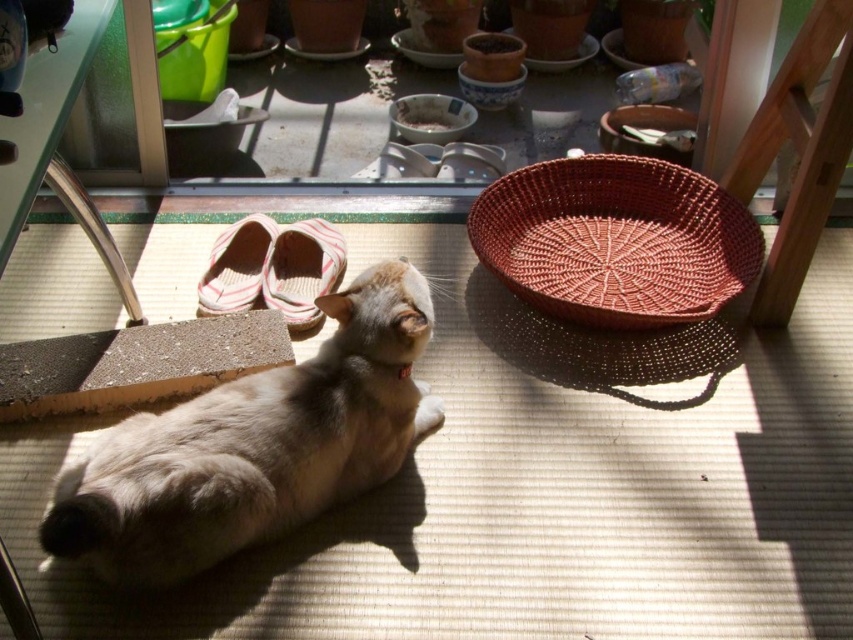
You are trying to decide whether to place a new small plant pot between the striped fabric shoe at center and the striped fabric slipper at lower left. Considering their widths, will there be enough space for the pot if it is 10 cm wide?

The striped fabric shoe at center is wider than the striped fabric slipper at lower left. However, the exact distance between them isn

You are a small robot with a 12 inch diameter. You need to move from the light brown fur cat at center to the brown woven basket at lower right. Can you fit through the space between them?

The distance between the light brown fur cat at center and the brown woven basket at lower right is 33.98 inches. Since the robot has a diameter of 12 inches, it can easily move through the space between them as the distance is more than sufficient for the robot to navigate.